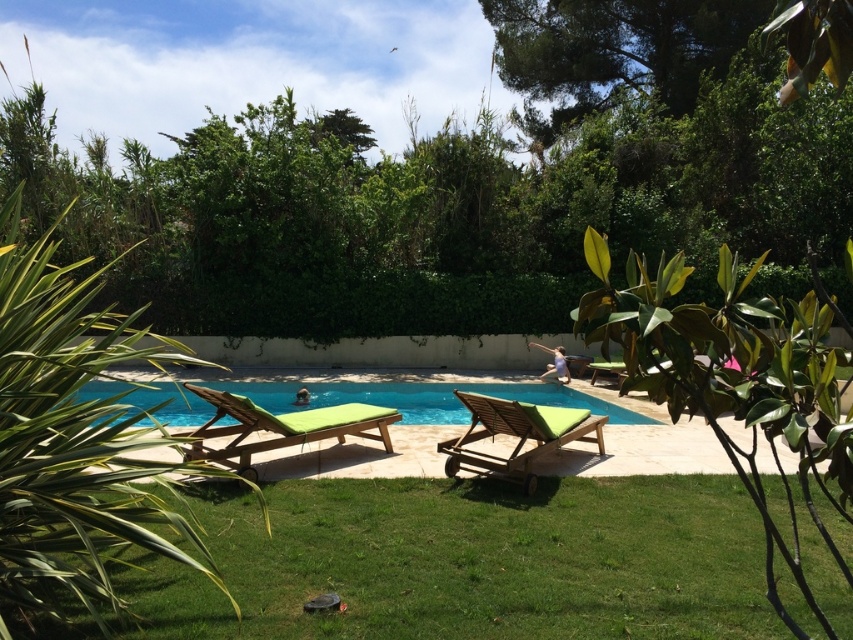
Question: Is green grass at lower center closer to the viewer compared to blue glassy swimming pool at center?

Choices:
 (A) yes
 (B) no

Answer: (A)

Question: Can you confirm if green grass at lower center is wider than blue glassy swimming pool at center?

Choices:
 (A) yes
 (B) no

Answer: (B)

Question: Which point appears closest to the camera in this image?

Choices:
 (A) (61, 257)
 (B) (651, 515)

Answer: (B)

Question: Can you confirm if green leafy tree at upper center is smaller than wooden lounge chair with green cushion at center?

Choices:
 (A) yes
 (B) no

Answer: (B)

Question: Which object is farther from the camera taking this photo?

Choices:
 (A) wooden lounge chair with green cushion at center
 (B) blue glassy swimming pool at center
 (C) green fabric lounge chair at lower center

Answer: (B)

Question: Which point is farther to the camera?

Choices:
 (A) green leafy tree at upper center
 (B) wooden lounge chair with green cushion at center
 (C) green grass at lower center
 (D) blue glassy swimming pool at center

Answer: (A)